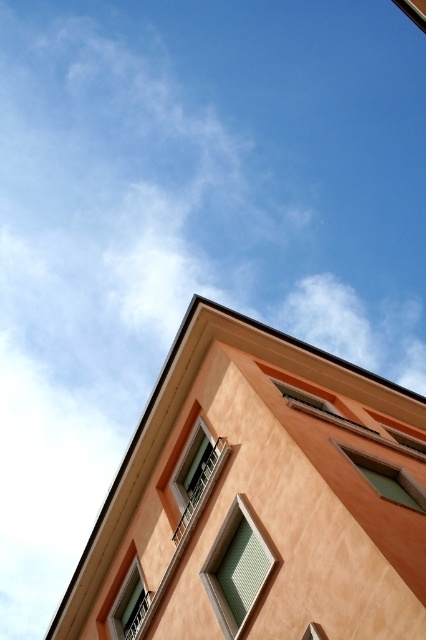
Who is lower down, green mesh window at center or green glass window at lower right?

green mesh window at center is below.

Does green mesh window at center have a larger size compared to green glass window at lower right?

Correct, green mesh window at center is larger in size than green glass window at lower right.

Is point (264, 586) positioned after point (382, 472)?

No, it is in front of (382, 472).

I want to click on green mesh window at center, so click(236, 568).

Does green glass window at lower right have a smaller size compared to matte glass window at lower left?

No.

Is green glass window at lower right to the right of matte glass window at lower left from the viewer's perspective?

Yes, green glass window at lower right is to the right of matte glass window at lower left.

Describe the element at coordinates (388, 480) in the screenshot. I see `green glass window at lower right` at that location.

Locate an element on the screen. green glass window at lower right is located at coordinates (388, 480).

Can you confirm if matte glass window at center is shorter than green glass window at lower right?

No.

The height and width of the screenshot is (640, 426). Find the location of `matte glass window at center`. matte glass window at center is located at coordinates (195, 476).

The height and width of the screenshot is (640, 426). I want to click on matte glass window at center, so click(195, 476).